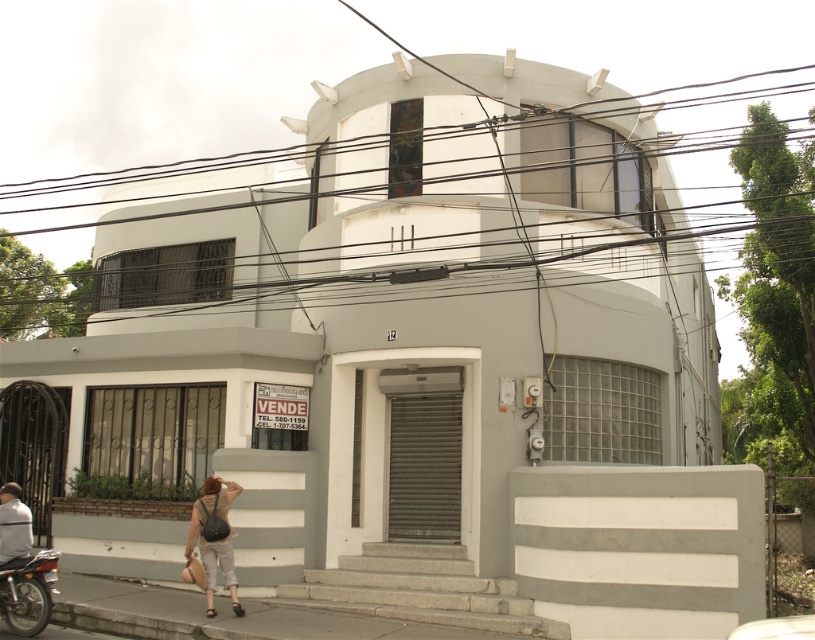
Which is in front, point (236, 488) or point (10, 516)?

Point (10, 516) is more forward.

Is the position of light beige pants at lower left more distant than that of gray fabric jacket at lower left?

Yes.

This screenshot has height=640, width=815. Describe the element at coordinates (214, 538) in the screenshot. I see `light beige pants at lower left` at that location.

Image resolution: width=815 pixels, height=640 pixels. What are the coordinates of `light beige pants at lower left` in the screenshot? It's located at (214, 538).

Does black wire at upper center have a larger size compared to gray fabric jacket at lower left?

Yes.

Is point (653, 112) more distant than point (16, 508)?

Yes, it is.

Identify the location of black wire at upper center. The image size is (815, 640). (139, 172).

Which of these two, black wire at upper center or metallic red motorcycle at lower left, stands taller?

With more height is black wire at upper center.

Does black wire at upper center appear over metallic red motorcycle at lower left?

Correct, black wire at upper center is located above metallic red motorcycle at lower left.

Between point (716, 202) and point (20, 586), which one is positioned in front?

Point (20, 586) is more forward.

Locate an element on the screen. The width and height of the screenshot is (815, 640). black wire at upper center is located at coordinates (139, 172).